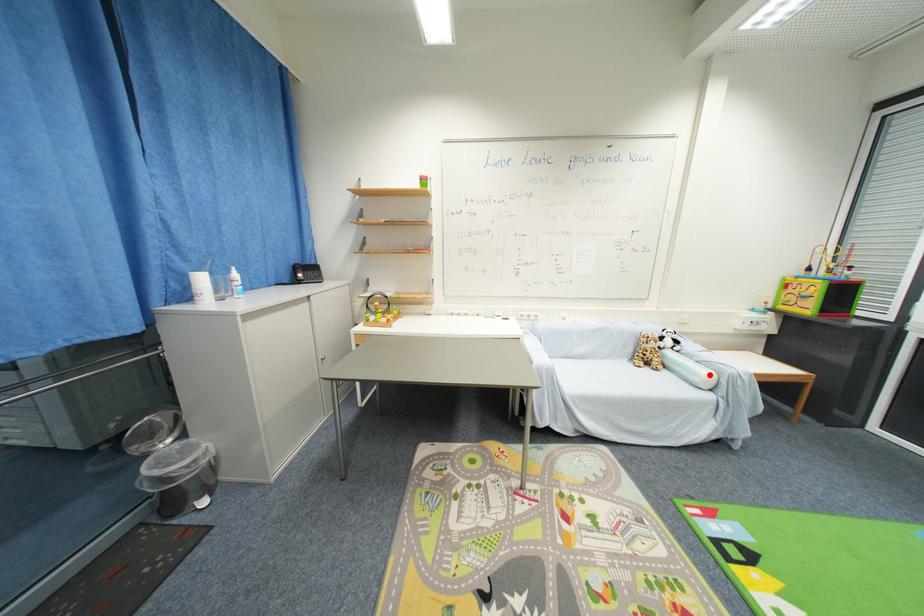
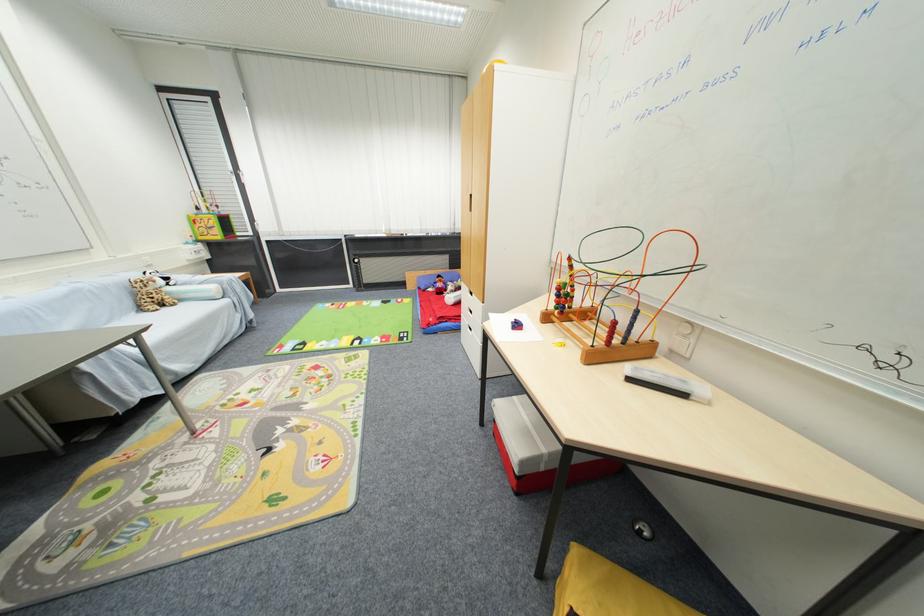
In the second image, find the point that corresponds to the highlighted location in the first image.

(217, 290)